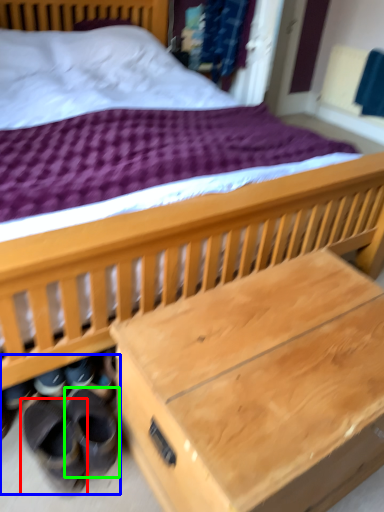
Question: Based on their relative distances, which object is nearer to footwear (highlighted by a red box)? Choose from shoe (highlighted by a blue box) and footwear (highlighted by a green box).

Choices:
 (A) shoe
 (B) footwear

Answer: (A)